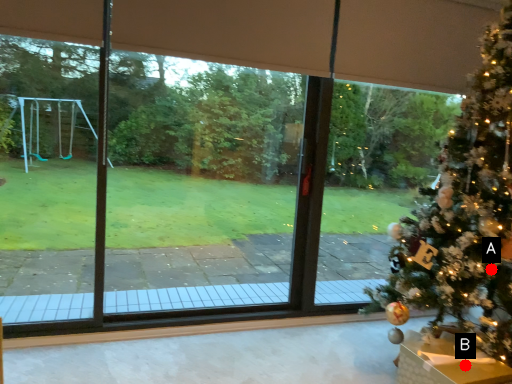
Question: Two points are circled on the image, labeled by A and B beside each circle. Which point is closer to the camera?

Choices:
 (A) A is closer
 (B) B is closer

Answer: (B)